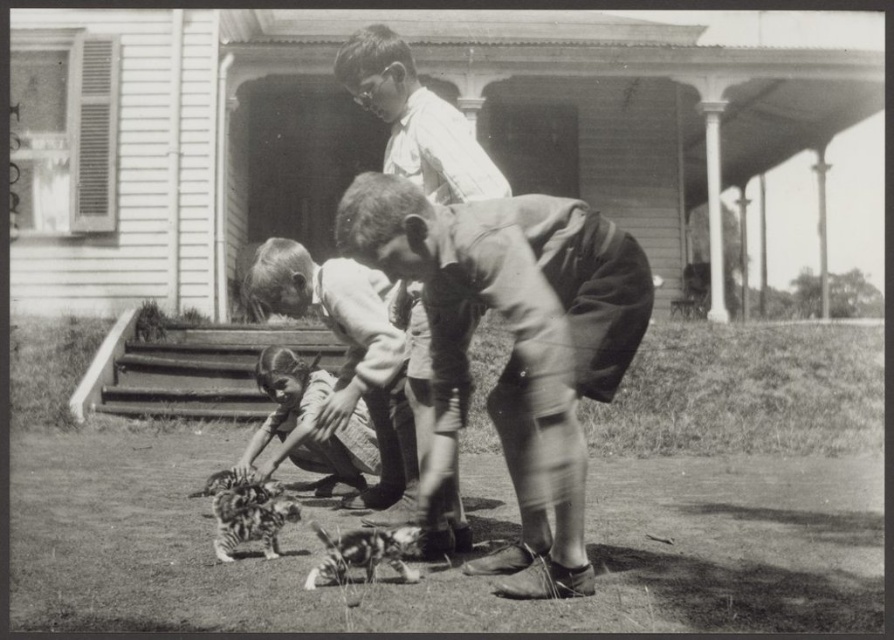
Who is taller, leather boots at center or smooth white shirt at center?

leather boots at center is taller.

Which of these two, leather boots at center or smooth white shirt at center, stands shorter?

smooth white shirt at center

Does point (407, 252) come farther from viewer compared to point (420, 93)?

No, (407, 252) is closer to viewer.

Identify the location of leather boots at center. (513, 342).

Which is behind, point (423, 161) or point (308, 401)?

The point (308, 401) is behind.

Is smooth white shirt at center above smooth fabric dress at lower left?

Indeed, smooth white shirt at center is positioned over smooth fabric dress at lower left.

Is point (461, 115) closer to camera compared to point (296, 396)?

Yes, point (461, 115) is in front of point (296, 396).

Find the location of a particular element. smooth white shirt at center is located at coordinates (416, 120).

Measure the distance between point [403,138] and camera.

They are 4.97 meters apart.

Is smooth white shirt at center taller than smooth fabric dress at center?

No, smooth white shirt at center is not taller than smooth fabric dress at center.

Is point (447, 182) behind point (386, 320)?

No.

Where is `smooth white shirt at center`? Image resolution: width=894 pixels, height=640 pixels. smooth white shirt at center is located at coordinates (416, 120).